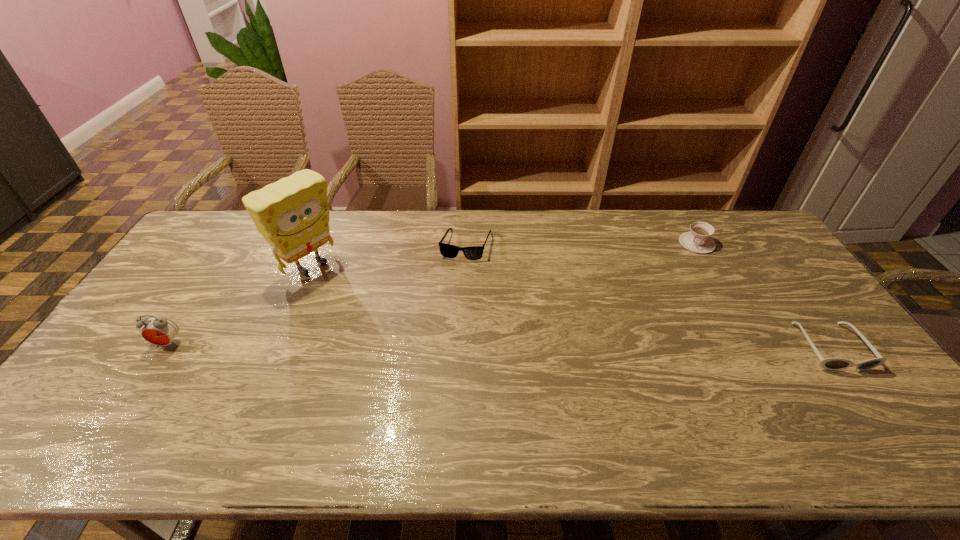
Locate an element on the screen. This screenshot has width=960, height=540. empty space between the left sunglasses and the alarm clock is located at coordinates (318, 294).

This screenshot has width=960, height=540. Find the location of `vacant area between the teacup and the rightmost object`. vacant area between the teacup and the rightmost object is located at coordinates (764, 295).

Identify the location of free space between the fourth object from left to right and the second object from left to right. (504, 255).

In order to click on unoccupied position between the fourth object from right to left and the third object from right to left in this screenshot , I will do `click(389, 255)`.

Find the location of a particular element. This screenshot has height=540, width=960. vacant area between the second object from right to left and the farther sunglasses is located at coordinates (582, 244).

Locate an element on the screen. The width and height of the screenshot is (960, 540). vacant area that lies between the teacup and the tallest object is located at coordinates (504, 255).

Where is `vacant area that lies between the farther sunglasses and the leftmost object`? This screenshot has height=540, width=960. vacant area that lies between the farther sunglasses and the leftmost object is located at coordinates (318, 294).

You are a GUI agent. You are given a task and a screenshot of the screen. Output one action in this format:
    pyautogui.click(x=<x>, y=<y>)
    Task: Click on the blank region between the fourth shortest object and the teacup
    The width and height of the screenshot is (960, 540).
    Given the screenshot: What is the action you would take?
    pyautogui.click(x=433, y=293)

Find the location of a particular element. free space that is in between the left sunglasses and the rightmost object is located at coordinates (648, 296).

What are the coordinates of `object that is the second nearest to the second object from right to left` in the screenshot? It's located at (449, 251).